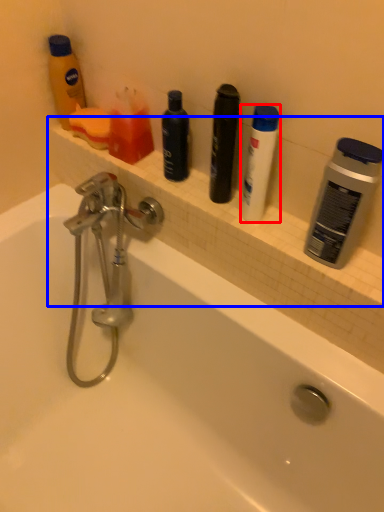
Question: Which point is closer to the camera, toiletry (highlighted by a red box) or ledge (highlighted by a blue box)?

Choices:
 (A) toiletry
 (B) ledge

Answer: (A)